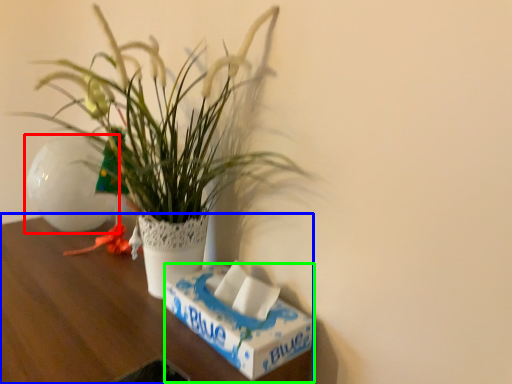
Question: Which object is the farthest from flowerpot (highlighted by a red box)? Choose among these: table (highlighted by a blue box) or box (highlighted by a green box).

Choices:
 (A) table
 (B) box

Answer: (B)